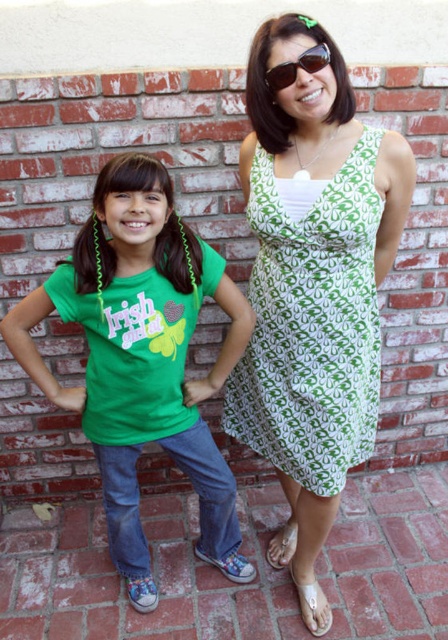
This screenshot has width=448, height=640. What do you see at coordinates (311, 326) in the screenshot?
I see `green printed dress at center` at bounding box center [311, 326].

Does green printed dress at center appear on the left side of sunglasses at center?

Incorrect, green printed dress at center is not on the left side of sunglasses at center.

Measure the distance between green printed dress at center and camera.

green printed dress at center and camera are 4.58 feet apart from each other.

Identify the location of green printed dress at center. (311, 326).

Which is in front, point (54, 289) or point (319, 45)?

Point (319, 45) is in front.

Between green matte shirt at center and sunglasses at center, which one appears on the left side from the viewer's perspective?

From the viewer's perspective, green matte shirt at center appears more on the left side.

Does point (146, 572) come closer to viewer compared to point (318, 67)?

No, it is behind (318, 67).

I want to click on green matte shirt at center, so click(142, 358).

Does green matte shirt at center have a smaller size compared to green printed dress at center?

Incorrect, green matte shirt at center is not smaller in size than green printed dress at center.

Where is `green matte shirt at center`? This screenshot has width=448, height=640. green matte shirt at center is located at coordinates (142, 358).